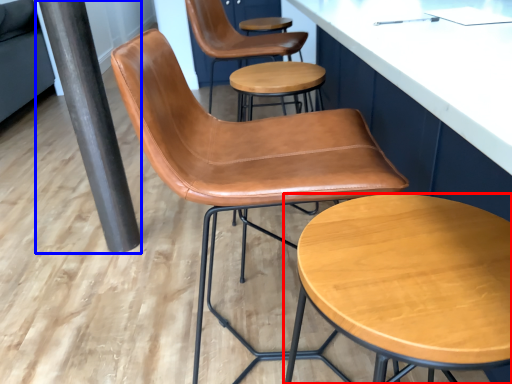
Question: Which object appears farthest to the camera in this image, stool (highlighted by a red box) or beam (highlighted by a blue box)?

Choices:
 (A) stool
 (B) beam

Answer: (B)